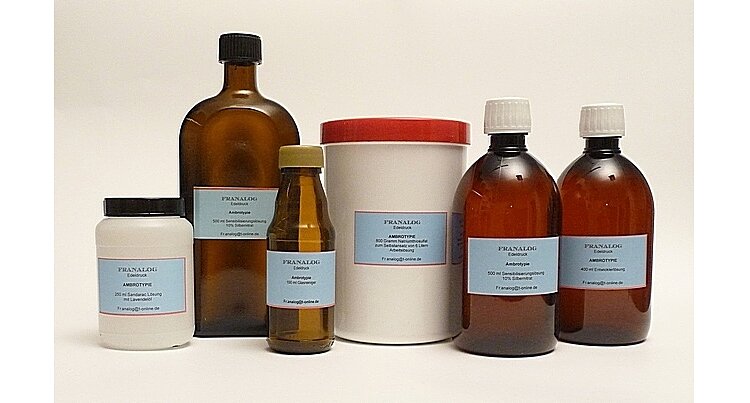
This screenshot has height=403, width=750. I want to click on bottles, so click(494, 293).